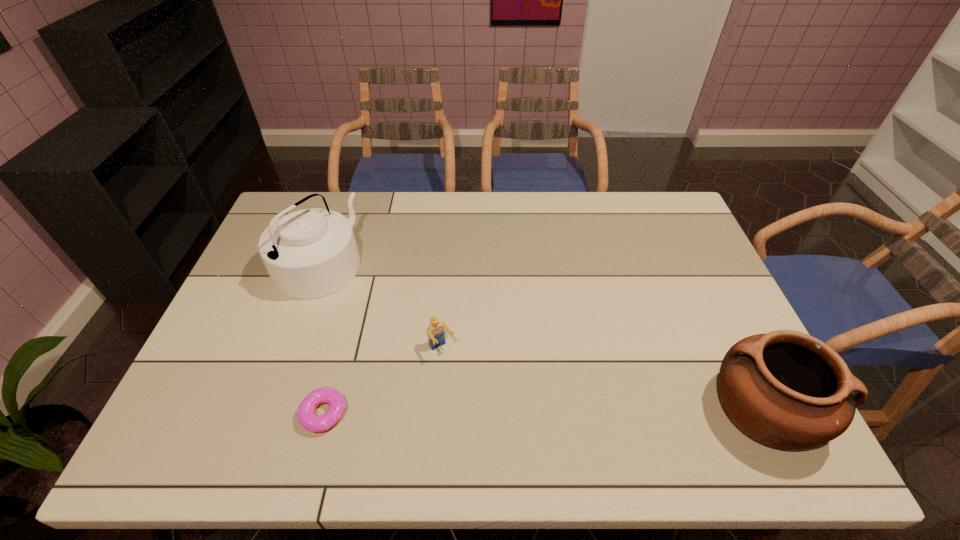
This screenshot has height=540, width=960. What are the coordinates of `free space in the image that satisfies the following two spatial constraints: 1. on the back side of the doughnut; 2. on the right side of the Lego` in the screenshot? It's located at (341, 349).